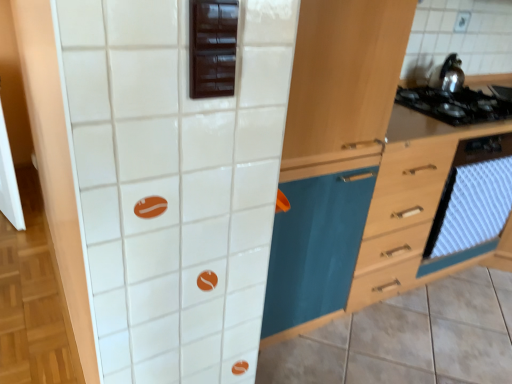
Question: Is wooden cabinet at center further to camera compared to wooden drawer at right?

Choices:
 (A) yes
 (B) no

Answer: (B)

Question: From the image's perspective, would you say wooden cabinet at center is shown under wooden drawer at right?

Choices:
 (A) no
 (B) yes

Answer: (B)

Question: Is wooden cabinet at center thinner than wooden drawer at right?

Choices:
 (A) yes
 (B) no

Answer: (B)

Question: Considering the relative sizes of wooden cabinet at center and wooden drawer at right in the image provided, is wooden cabinet at center wider than wooden drawer at right?

Choices:
 (A) no
 (B) yes

Answer: (B)

Question: Is wooden drawer at right at the back of wooden cabinet at center?

Choices:
 (A) yes
 (B) no

Answer: (B)

Question: Is wooden drawer at right inside wooden cabinet at center?

Choices:
 (A) no
 (B) yes

Answer: (A)

Question: Considering the relative sizes of shiny metallic kettle at upper right and wooden drawer at right in the image provided, is shiny metallic kettle at upper right taller than wooden drawer at right?

Choices:
 (A) no
 (B) yes

Answer: (A)

Question: Would you consider shiny metallic kettle at upper right to be distant from wooden drawer at right?

Choices:
 (A) no
 (B) yes

Answer: (A)

Question: Is shiny metallic kettle at upper right closer to camera compared to wooden drawer at right?

Choices:
 (A) no
 (B) yes

Answer: (A)

Question: Could you tell me if shiny metallic kettle at upper right is turned towards wooden drawer at right?

Choices:
 (A) yes
 (B) no

Answer: (B)

Question: Is shiny metallic kettle at upper right bigger than wooden drawer at right?

Choices:
 (A) no
 (B) yes

Answer: (A)

Question: Considering the relative sizes of shiny metallic kettle at upper right and wooden drawer at right in the image provided, is shiny metallic kettle at upper right thinner than wooden drawer at right?

Choices:
 (A) yes
 (B) no

Answer: (A)

Question: Does wooden drawer at right lie in front of white textured oven at right?

Choices:
 (A) yes
 (B) no

Answer: (A)